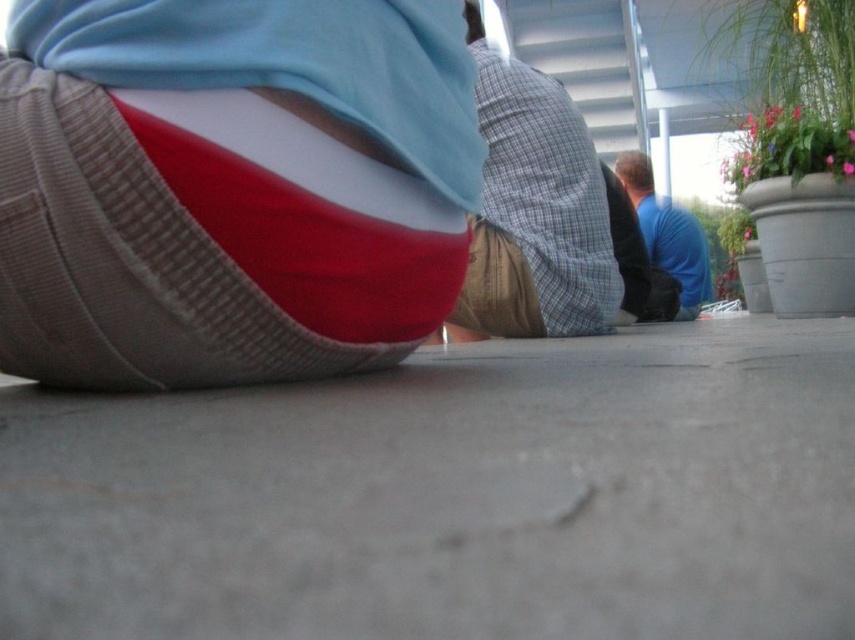
Question: Which of these objects is positioned closest to the blue cotton shirt at upper right?

Choices:
 (A) plaid fabric shirt at center
 (B) gray concrete pavement at lower center

Answer: (A)

Question: Where is knitted fabric pants at lower left located in relation to blue cotton shirt at upper right in the image?

Choices:
 (A) left
 (B) right

Answer: (A)

Question: Is plaid fabric shirt at center smaller than blue cotton shirt at upper right?

Choices:
 (A) no
 (B) yes

Answer: (B)

Question: Among these points, which one is farthest from the camera?

Choices:
 (A) (91, 289)
 (B) (523, 330)

Answer: (B)

Question: Which point is closer to the camera?

Choices:
 (A) gray concrete pavement at lower center
 (B) knitted fabric pants at lower left
 (C) plaid fabric shirt at center

Answer: (A)

Question: Is gray concrete pavement at lower center behind plaid fabric shirt at center?

Choices:
 (A) no
 (B) yes

Answer: (A)